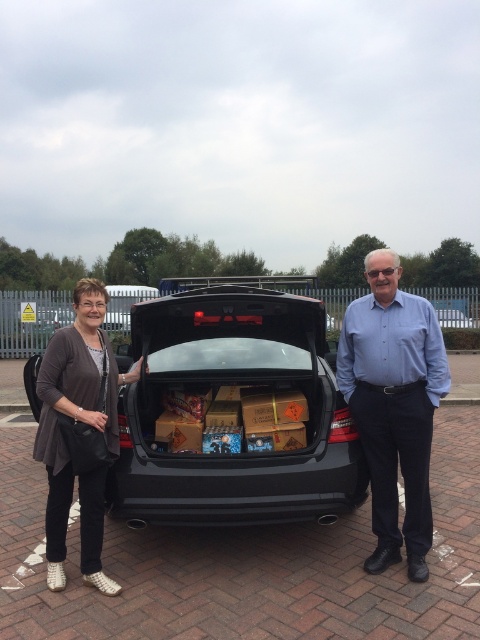
Is black matte car trunk at center further to camera compared to dark gray sweater at left?

Yes, it is.

Does black matte car trunk at center appear over dark gray sweater at left?

Yes, black matte car trunk at center is above dark gray sweater at left.

This screenshot has height=640, width=480. What do you see at coordinates (232, 412) in the screenshot? I see `black matte car trunk at center` at bounding box center [232, 412].

Locate an element on the screen. black matte car trunk at center is located at coordinates (232, 412).

Can you confirm if matte black car at center is bigger than dark gray sweater at left?

Correct, matte black car at center is larger in size than dark gray sweater at left.

Is matte black car at center to the left of dark gray sweater at left from the viewer's perspective?

In fact, matte black car at center is to the right of dark gray sweater at left.

Measure the distance between matte black car at center and camera.

matte black car at center is 3.30 meters from camera.

The width and height of the screenshot is (480, 640). Identify the location of matte black car at center. (219, 406).

Can you confirm if matte black car at center is positioned below black matte car trunk at center?

No, matte black car at center is not below black matte car trunk at center.

Between point (70, 330) and point (264, 508), which one is positioned in front?

Point (70, 330)

Where is `matte black car at center`? Image resolution: width=480 pixels, height=640 pixels. matte black car at center is located at coordinates (219, 406).